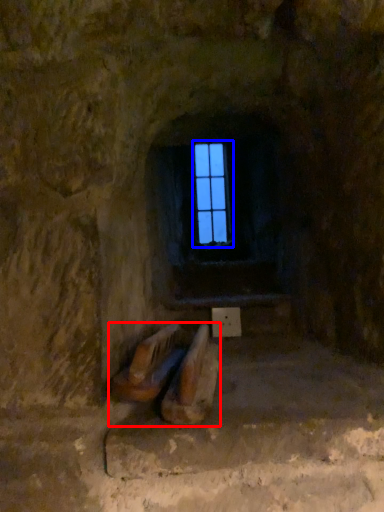
Question: Which point is closer to the camera, furniture (highlighted by a red box) or window frame (highlighted by a blue box)?

Choices:
 (A) furniture
 (B) window frame

Answer: (A)